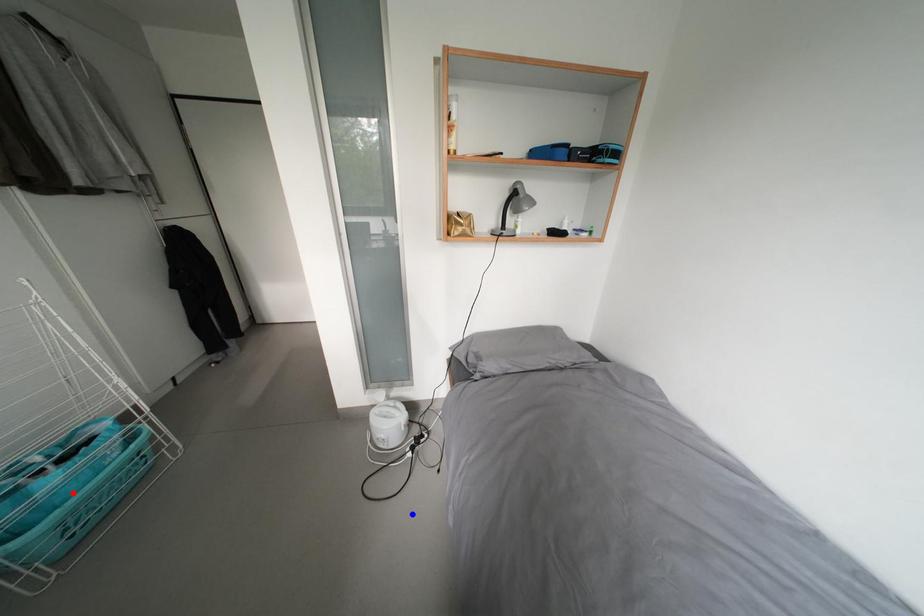
Question: In the image, two points are highlighted. Which point is nearer to the camera? Reply with the corresponding letter.

Choices:
 (A) blue point
 (B) red point

Answer: (B)